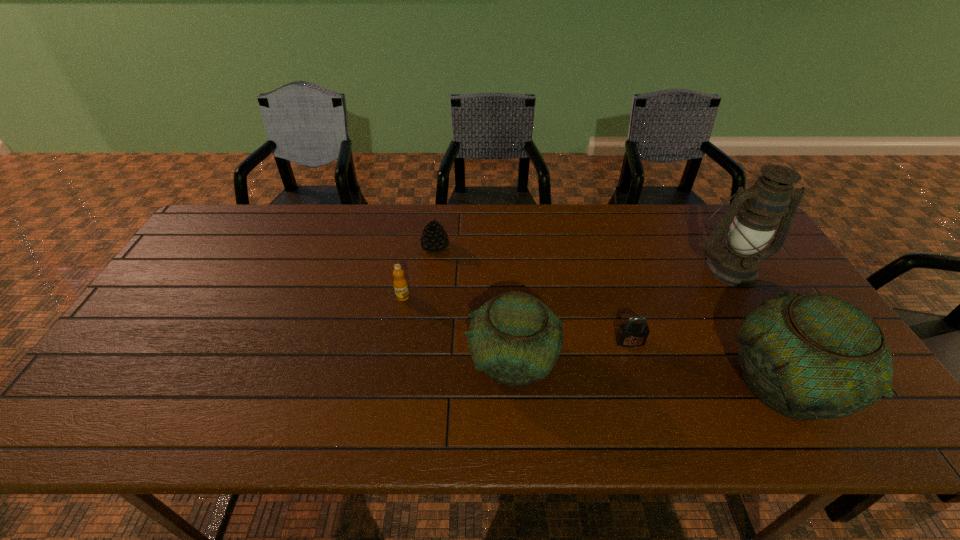
Locate which object ranks second in proximity to the second tallest object. Please provide its 2D coordinates. Your answer should be formatted as a tuple, i.e. [(x, y)], where the tuple contains the x and y coordinates of a point satisfying the conditions above.

[(758, 209)]

Where is `object that is the fifth nearest to the fifth object from right to left`? object that is the fifth nearest to the fifth object from right to left is located at coordinates (812, 356).

Image resolution: width=960 pixels, height=540 pixels. I want to click on free space in the image that satisfies the following two spatial constraints: 1. on the front label of the orange juice; 2. on the right side of the right pottery, so click(388, 385).

The height and width of the screenshot is (540, 960). I want to click on vacant position in the image that satisfies the following two spatial constraints: 1. at the narrow end of the second object from left to right; 2. on the back side of the tallest object, so click(x=433, y=268).

You are a GUI agent. You are given a task and a screenshot of the screen. Output one action in this format:
    pyautogui.click(x=<x>, y=<y>)
    Task: Click on the free location that satisfies the following two spatial constraints: 1. at the narrow end of the pinecone; 2. on the back side of the taller pottery
    
    Given the screenshot: What is the action you would take?
    pyautogui.click(x=420, y=385)

Image resolution: width=960 pixels, height=540 pixels. Find the location of `vacant region that satisfies the following two spatial constraints: 1. on the back side of the fifth shortest object; 2. at the narrow end of the pinecone`. vacant region that satisfies the following two spatial constraints: 1. on the back side of the fifth shortest object; 2. at the narrow end of the pinecone is located at coordinates (707, 247).

What are the coordinates of `vacant position in the image that satisfies the following two spatial constraints: 1. on the back side of the oil lamp; 2. at the narrow end of the pinecone` in the screenshot? It's located at (717, 247).

I want to click on free space that satisfies the following two spatial constraints: 1. on the front of the right pottery near the keyhole; 2. on the left side of the padlock, so click(x=643, y=385).